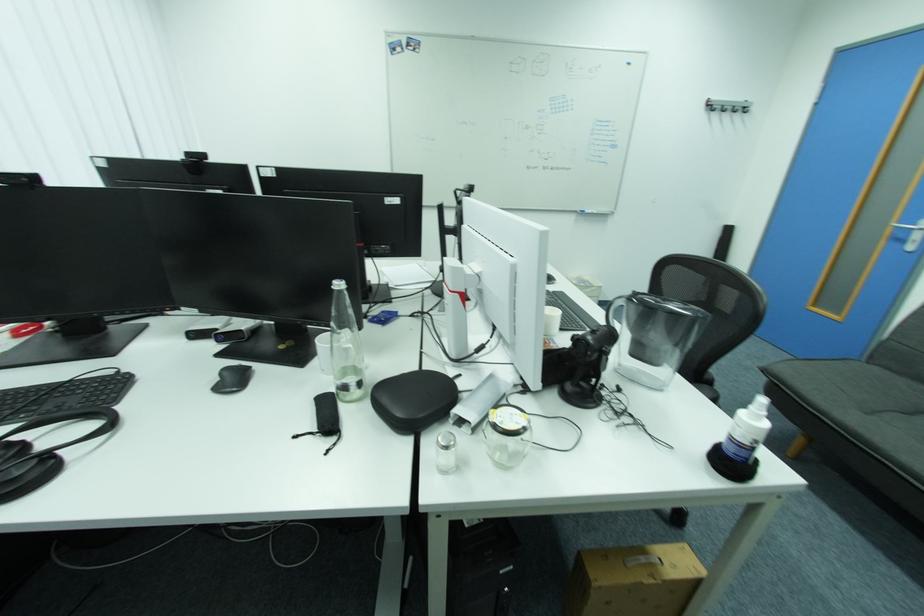
Where would you shak the small glass shaker? Please return your answer as a coordinate pair (x, y).

(445, 440)